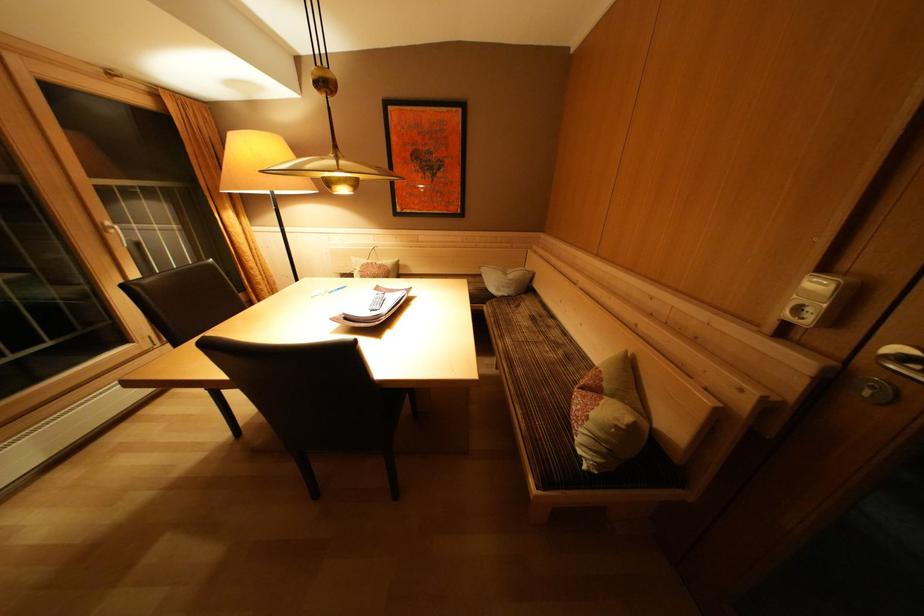
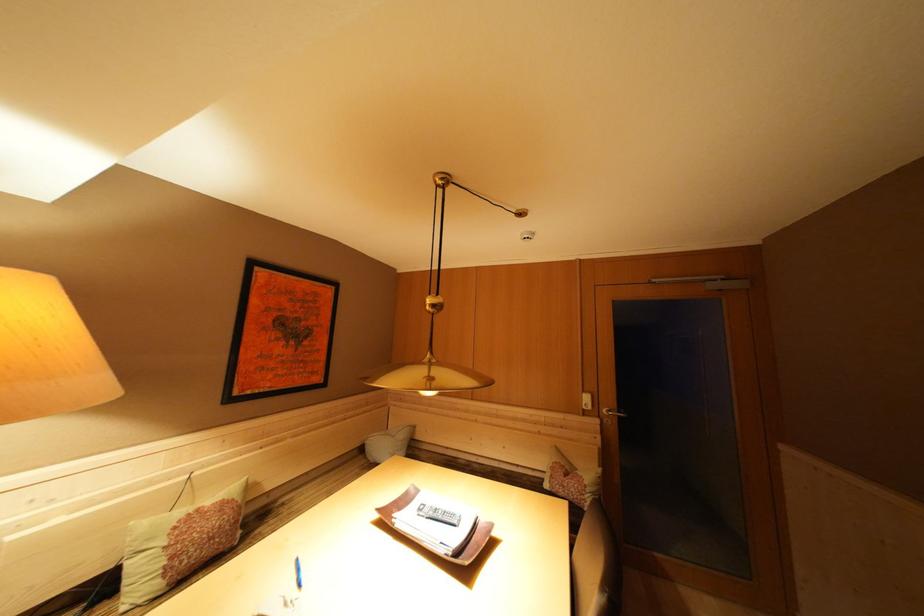
In the second image, find the point that corresponds to (379,268) in the first image.

(204, 515)